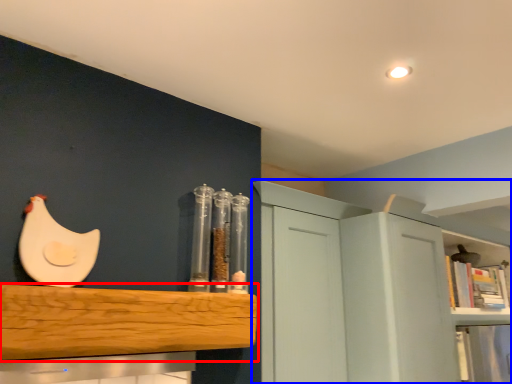
Question: Among these objects, which one is nearest to the camera, shelf (highlighted by a red box) or cabinetry (highlighted by a blue box)?

Choices:
 (A) shelf
 (B) cabinetry

Answer: (A)